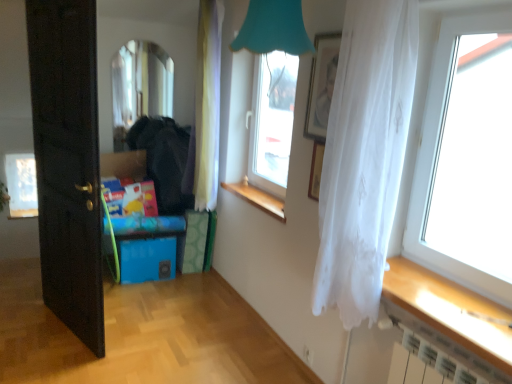
Question: From a real-world perspective, relative to wooden at center, is clear glass mirror at upper left, marked as the second window in a back-to-front arrangement, vertically above or below?

Choices:
 (A) below
 (B) above

Answer: (B)

Question: Looking at their shapes, would you say clear glass mirror at upper left, the third window positioned from the front, is wider or thinner than wooden at center?

Choices:
 (A) thin
 (B) wide

Answer: (A)

Question: Considering the real-world distances, which object is farthest from the blue plastic storage box at lower left?

Choices:
 (A) white sheer curtain at center, the 1th curtain viewed from the left
 (B) transparent glass window at right, the 4th window positioned from the left
 (C) clear glass mirror at upper left, marked as the second window in a back-to-front arrangement
 (D) white sheer curtain at right, the first curtain from the right
 (E) transparent glass window at center, arranged as the second window when viewed from the front

Answer: (B)

Question: Considering the real-world distances, which object is closest to the matte silver picture frame at upper center?

Choices:
 (A) clear glass mirror at upper left, which ranks as the 2th window in left-to-right order
 (B) black wood door at left
 (C) white sheer curtain at center, the 1th curtain viewed from the left
 (D) white sheer curtain at right, the first curtain from the right
 (E) transparent glass window at right, the 4th window positioned from the left

Answer: (D)